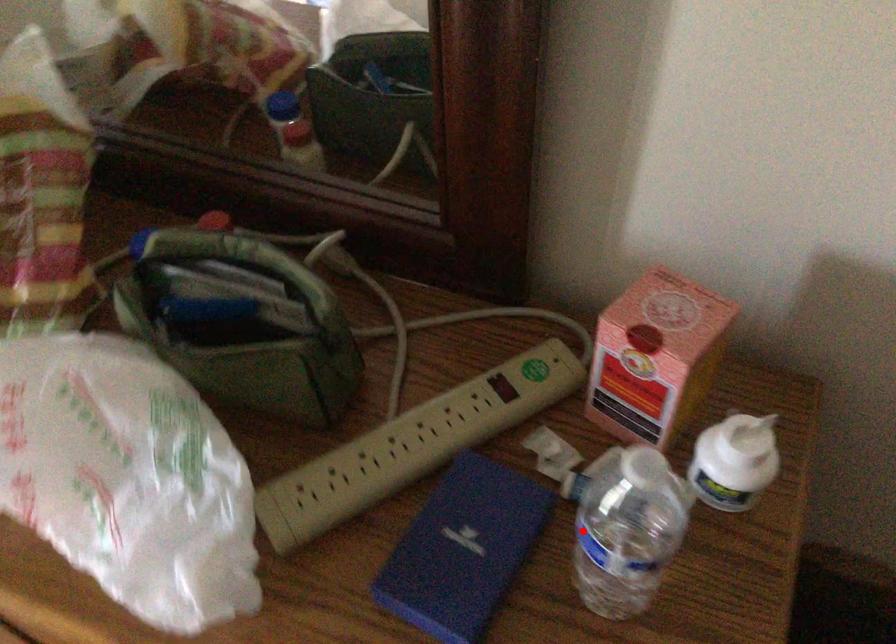
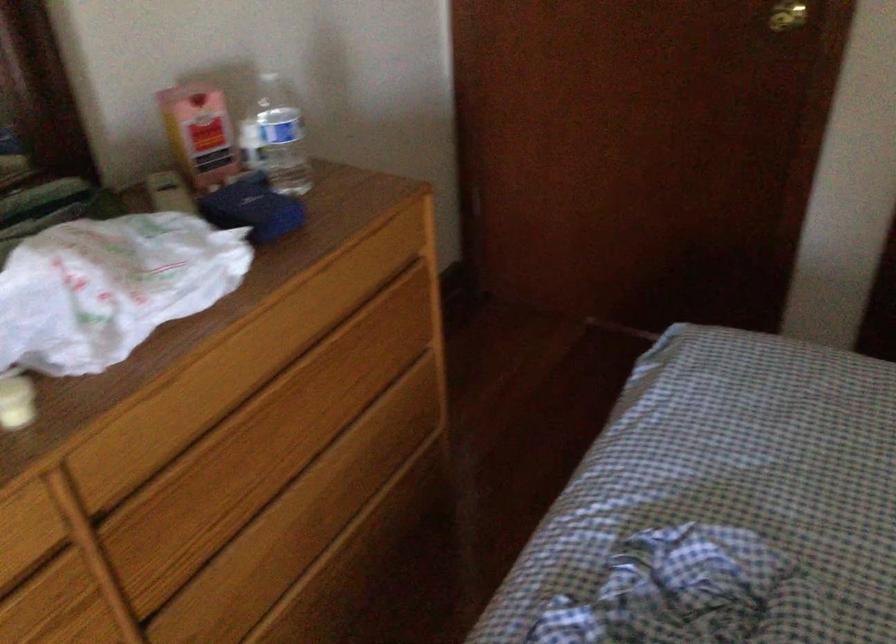
Question: I am providing you with two images of the same scene from different viewpoints. In image1, a red point is highlighted. Considering the same 3D point in image2, which of the following is correct?

Choices:
 (A) It is closer
 (B) It is farther

Answer: (B)